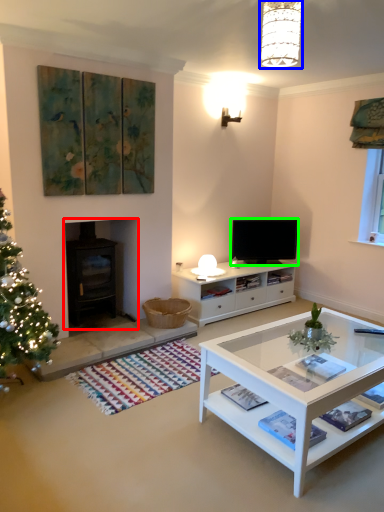
Question: Which object is the closest to the fireplace (highlighted by a red box)? Choose among these: lamp (highlighted by a blue box) or television (highlighted by a green box).

Choices:
 (A) lamp
 (B) television

Answer: (B)